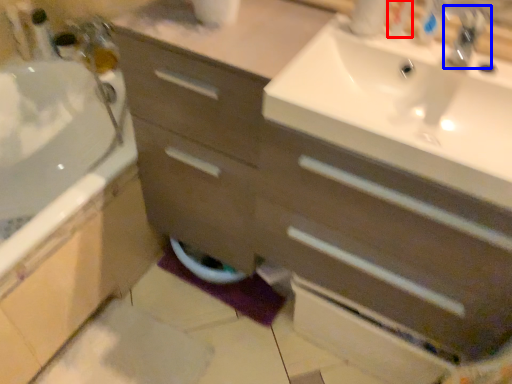
Question: Among these objects, which one is nearest to the camera, toiletry (highlighted by a red box) or tap (highlighted by a blue box)?

Choices:
 (A) toiletry
 (B) tap

Answer: (B)